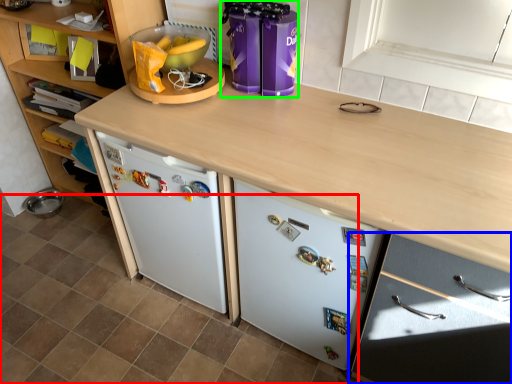
Question: Which object is the closest to the tile (highlighted by a red box)? Choose among these: cabinetry (highlighted by a blue box) or appliance (highlighted by a green box).

Choices:
 (A) cabinetry
 (B) appliance

Answer: (A)